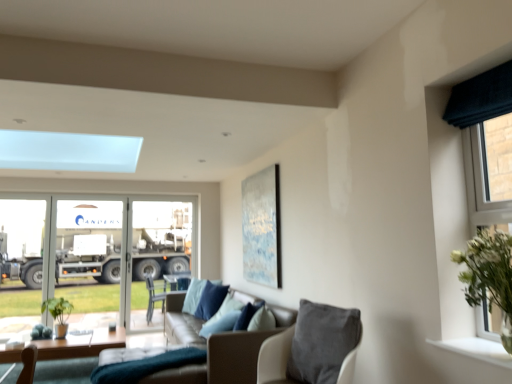
Question: From the image's perspective, is leather couch at center located beneath metallic silver trailer truck at left?

Choices:
 (A) no
 (B) yes

Answer: (B)

Question: Is leather couch at center placed right next to metallic silver trailer truck at left?

Choices:
 (A) yes
 (B) no

Answer: (B)

Question: Considering the relative positions of leather couch at center and metallic silver trailer truck at left in the image provided, is leather couch at center to the right of metallic silver trailer truck at left from the viewer's perspective?

Choices:
 (A) yes
 (B) no

Answer: (A)

Question: Would you say leather couch at center is outside metallic silver trailer truck at left?

Choices:
 (A) no
 (B) yes

Answer: (B)

Question: From a real-world perspective, is leather couch at center over metallic silver trailer truck at left?

Choices:
 (A) yes
 (B) no

Answer: (B)

Question: Does leather couch at center have a lesser height compared to metallic silver trailer truck at left?

Choices:
 (A) yes
 (B) no

Answer: (A)

Question: Is wooden table at lower left positioned far away from transparent glass screen door at center?

Choices:
 (A) no
 (B) yes

Answer: (B)

Question: Can you confirm if wooden table at lower left is positioned to the left of transparent glass screen door at center?

Choices:
 (A) yes
 (B) no

Answer: (A)

Question: Is wooden table at lower left not within transparent glass screen door at center?

Choices:
 (A) yes
 (B) no

Answer: (A)

Question: Is wooden table at lower left beside transparent glass screen door at center?

Choices:
 (A) no
 (B) yes

Answer: (A)

Question: Is wooden table at lower left wider than transparent glass screen door at center?

Choices:
 (A) yes
 (B) no

Answer: (A)

Question: Considering the relative sizes of wooden table at lower left and transparent glass screen door at center in the image provided, is wooden table at lower left shorter than transparent glass screen door at center?

Choices:
 (A) yes
 (B) no

Answer: (A)

Question: From the image's perspective, is leather couch at center located above dark blue fabric curtain at right?

Choices:
 (A) no
 (B) yes

Answer: (A)